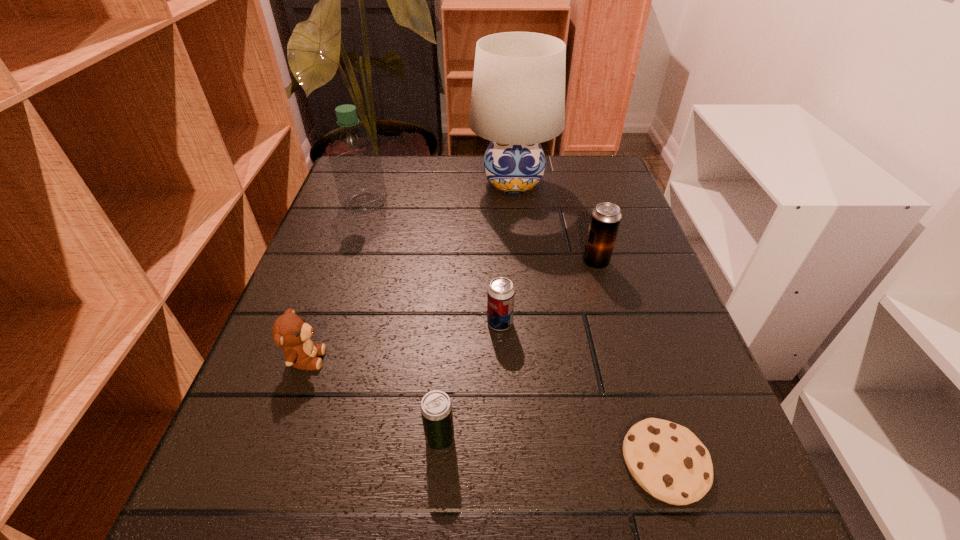
I want to click on the tallest object, so click(x=518, y=93).

This screenshot has width=960, height=540. I want to click on water bottle, so click(355, 158).

The width and height of the screenshot is (960, 540). What are the coordinates of `the fifth shortest object` in the screenshot? It's located at (605, 220).

Locate an element on the screen. The height and width of the screenshot is (540, 960). the tallest beer can is located at coordinates (605, 220).

Image resolution: width=960 pixels, height=540 pixels. What are the coordinates of `teddy bear` in the screenshot? It's located at (291, 332).

This screenshot has height=540, width=960. In order to click on the second nearest beer can in this screenshot , I will do `click(501, 293)`.

Locate an element on the screen. This screenshot has width=960, height=540. the fourth farthest object is located at coordinates (501, 293).

In order to click on the third object from left to right in this screenshot , I will do `click(436, 408)`.

The image size is (960, 540). Identify the location of the leftmost beer can. (436, 408).

Image resolution: width=960 pixels, height=540 pixels. I want to click on cookie, so click(667, 460).